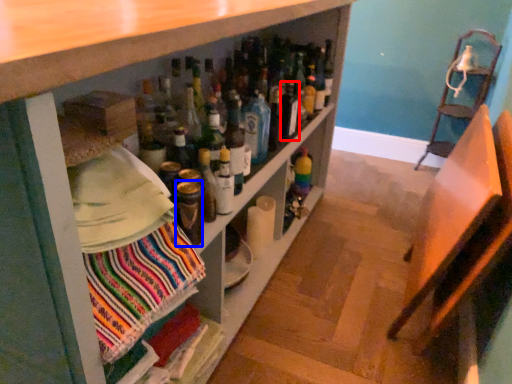
Question: Which object appears closest to the camera in this image, bottle (highlighted by a red box) or bottle (highlighted by a blue box)?

Choices:
 (A) bottle
 (B) bottle

Answer: (B)